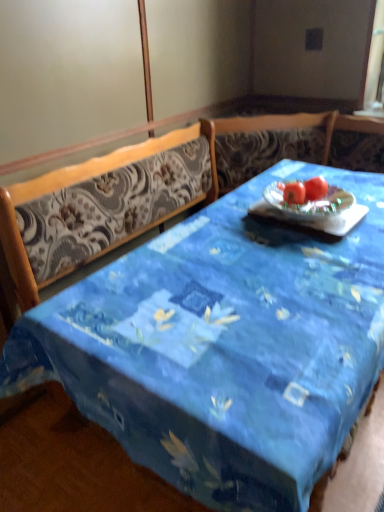
Question: Does red matte tomato at center contain red matte tomato at center?

Choices:
 (A) no
 (B) yes

Answer: (A)

Question: From the image's perspective, is red matte tomato at center over red matte tomato at center?

Choices:
 (A) yes
 (B) no

Answer: (A)

Question: From a real-world perspective, is red matte tomato at center below red matte tomato at center?

Choices:
 (A) no
 (B) yes

Answer: (B)

Question: From a real-world perspective, does red matte tomato at center stand above red matte tomato at center?

Choices:
 (A) no
 (B) yes

Answer: (A)

Question: Is red matte tomato at center completely or partially outside of red matte tomato at center?

Choices:
 (A) no
 (B) yes

Answer: (B)

Question: From their relative heights in the image, would you say red matte tomato at center is taller or shorter than blue fabric table at center?

Choices:
 (A) short
 (B) tall

Answer: (A)

Question: Based on their positions, is red matte tomato at center located to the left or right of blue fabric table at center?

Choices:
 (A) right
 (B) left

Answer: (A)

Question: Is red matte tomato at center situated inside blue fabric table at center or outside?

Choices:
 (A) inside
 (B) outside

Answer: (A)

Question: Does point tap(319, 181) appear closer or farther from the camera than point tap(243, 281)?

Choices:
 (A) farther
 (B) closer

Answer: (A)

Question: Would you say blue fabric table at center is to the left or to the right of red matte tomato at center in the picture?

Choices:
 (A) left
 (B) right

Answer: (B)

Question: From the image's perspective, is blue fabric table at center above or below red matte tomato at center?

Choices:
 (A) above
 (B) below

Answer: (B)

Question: In terms of height, does blue fabric table at center look taller or shorter compared to red matte tomato at center?

Choices:
 (A) tall
 (B) short

Answer: (A)

Question: From a real-world perspective, is blue fabric table at center physically located above or below red matte tomato at center?

Choices:
 (A) below
 (B) above

Answer: (A)

Question: Considering the positions of red matte tomato at center and red matte tomato at center in the image, is red matte tomato at center wider or thinner than red matte tomato at center?

Choices:
 (A) thin
 (B) wide

Answer: (A)

Question: Is point (306, 198) closer or farther from the camera than point (327, 185)?

Choices:
 (A) farther
 (B) closer

Answer: (B)